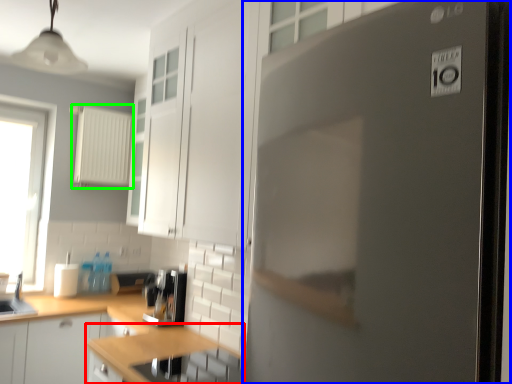
Question: Considering the real-world distances, which object is farthest from countertop (highlighted by a red box)? refrigerator (highlighted by a blue box) or appliance (highlighted by a green box)?

Choices:
 (A) refrigerator
 (B) appliance

Answer: (B)